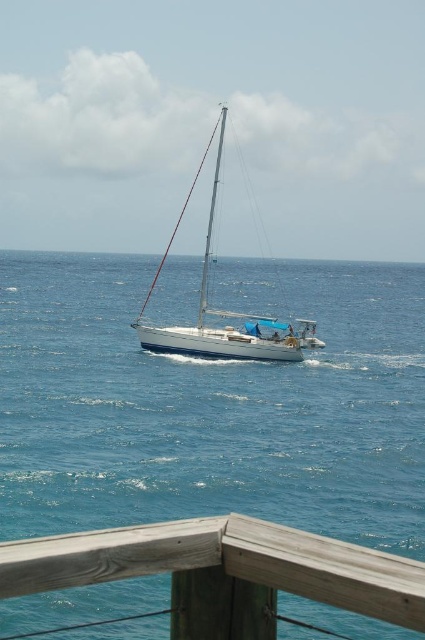
Can you confirm if blue water at center is smaller than white glossy sailboat at center?

No, blue water at center is not smaller than white glossy sailboat at center.

Where is `blue water at center`? The height and width of the screenshot is (640, 425). blue water at center is located at coordinates (210, 406).

What are the coordinates of `blue water at center` in the screenshot? It's located at (210, 406).

Is blue water at center to the left of wooden at lower left from the viewer's perspective?

Indeed, blue water at center is positioned on the left side of wooden at lower left.

Can you confirm if blue water at center is smaller than wooden at lower left?

No, blue water at center is not smaller than wooden at lower left.

Between point (11, 468) and point (277, 588), which one is positioned behind?

Point (11, 468)

The image size is (425, 640). Identify the location of blue water at center. (210, 406).

Does wooden at lower left have a smaller size compared to white glossy sailboat at center?

Indeed, wooden at lower left has a smaller size compared to white glossy sailboat at center.

Can you confirm if wooden at lower left is positioned to the left of white glossy sailboat at center?

No, wooden at lower left is not to the left of white glossy sailboat at center.

Is point (85, 536) closer to camera compared to point (271, 320)?

That is True.

This screenshot has height=640, width=425. What are the coordinates of `wooden at lower left` in the screenshot? It's located at (223, 572).